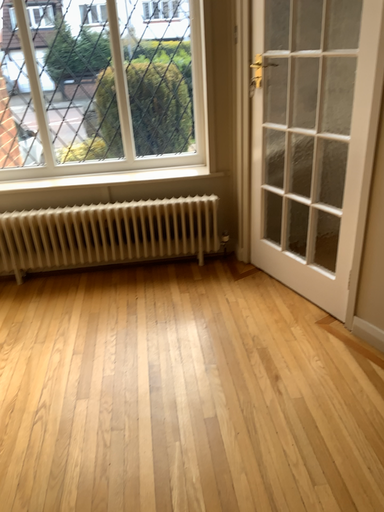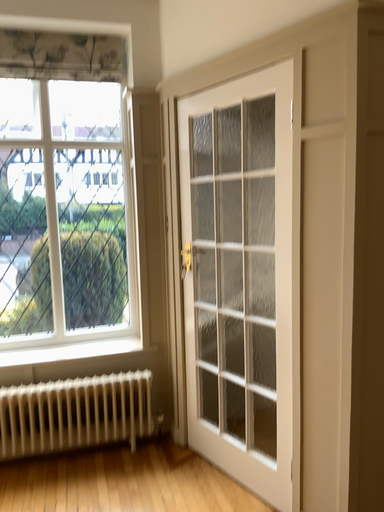
Question: Which way did the camera rotate in the video?

Choices:
 (A) rotated upward
 (B) rotated downward

Answer: (A)